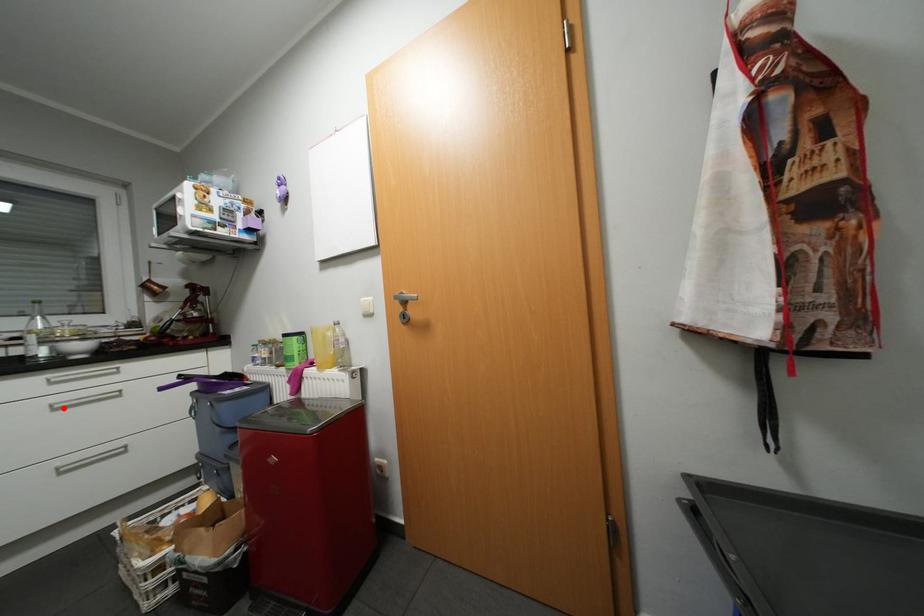
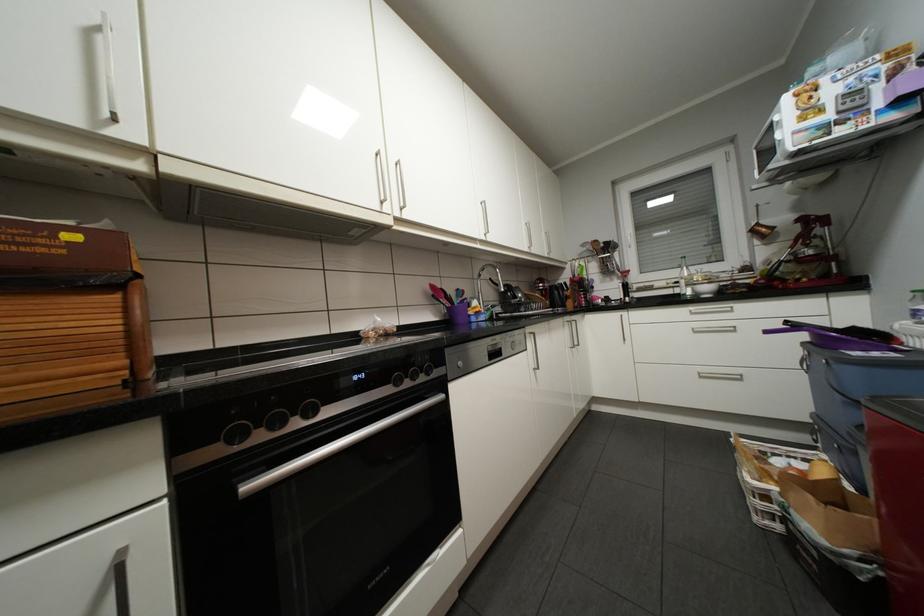
The point at the highlighted location is marked in the first image. Where is the corresponding point in the second image?

(703, 331)